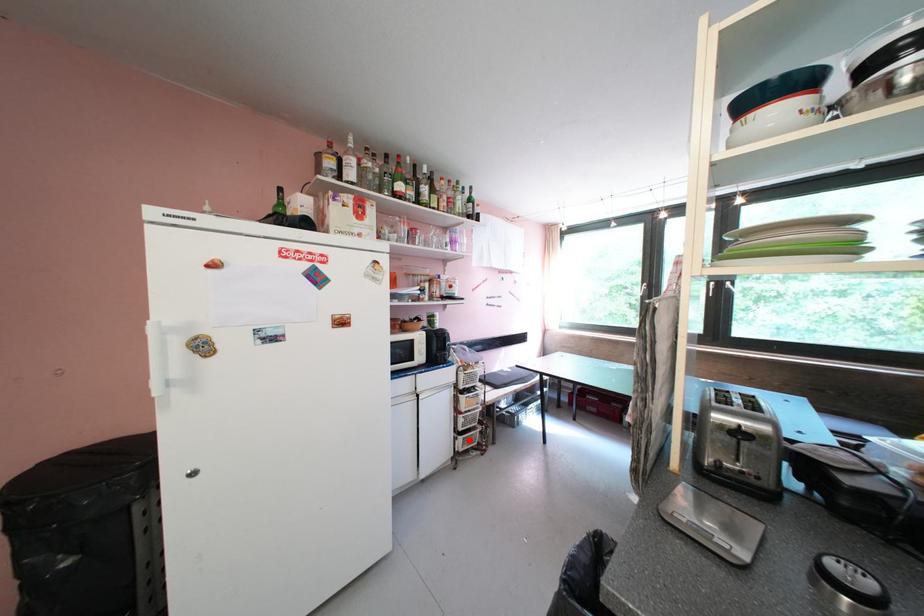
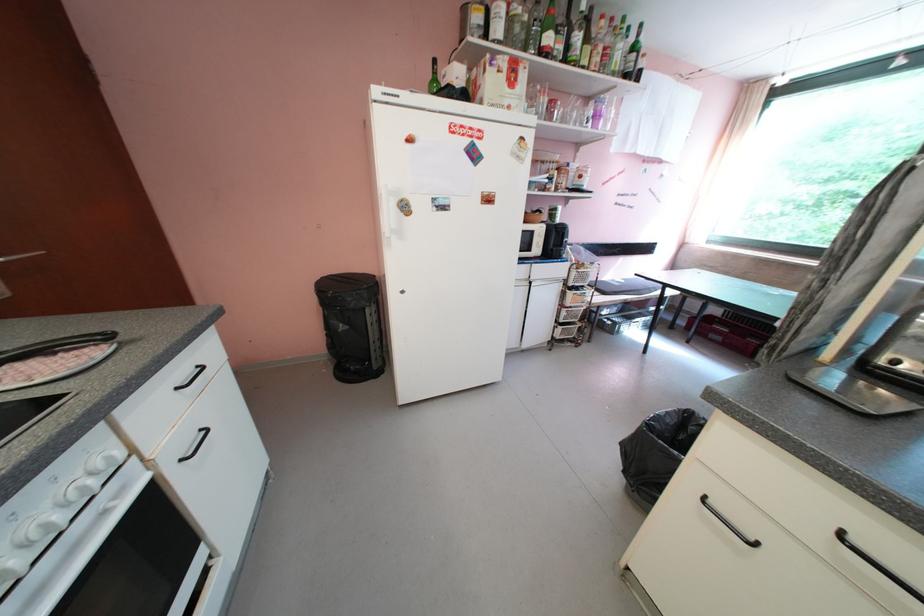
In the second image, find the point that corresponds to the highlighted location in the first image.

(568, 330)